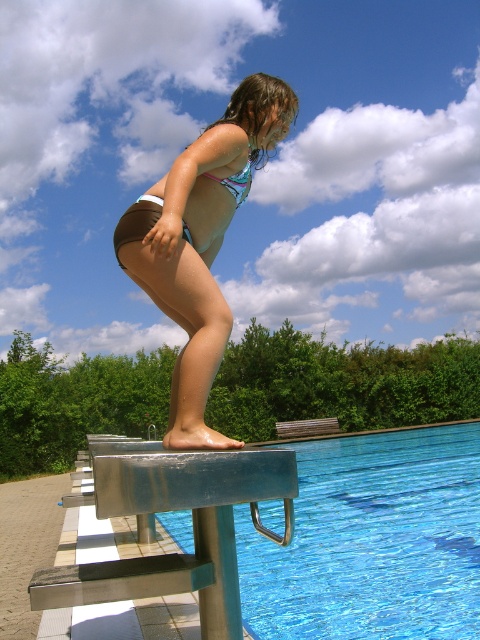
Question: Among these objects, which one is nearest to the camera?

Choices:
 (A) matte blue bikini at center
 (B) blue glassy water at center

Answer: (A)

Question: Which object is positioned closest to the pink shiny bikini at center?

Choices:
 (A) blue glassy water at center
 (B) matte blue bikini at center

Answer: (B)

Question: Does matte blue bikini at center have a larger size compared to pink shiny bikini at center?

Choices:
 (A) no
 (B) yes

Answer: (B)

Question: Considering the relative positions of blue glassy water at center and pink shiny bikini at center in the image provided, where is blue glassy water at center located with respect to pink shiny bikini at center?

Choices:
 (A) above
 (B) below

Answer: (B)

Question: Which of these objects is positioned farthest from the blue glassy water at center?

Choices:
 (A) pink shiny bikini at center
 (B) matte blue bikini at center

Answer: (A)

Question: Is blue glassy water at center in front of pink shiny bikini at center?

Choices:
 (A) no
 (B) yes

Answer: (A)